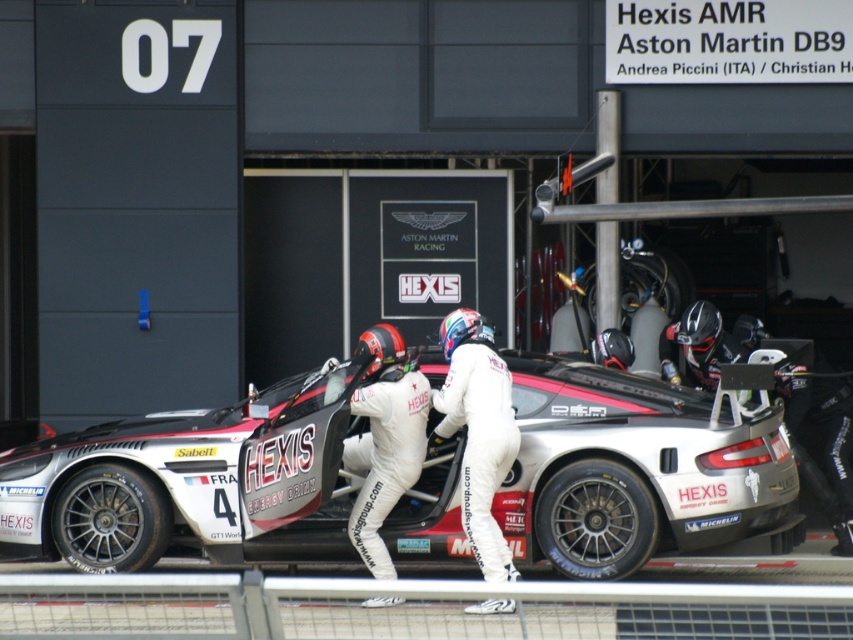
You are a photographer at the pit stop. You need to capture a clear photo of the white matte sports car at center without the white smooth suit at center blocking it. What should you do?

The white matte sports car at center is positioned under the white smooth suit at center. To avoid the obstruction, you can lower your camera angle to shoot from below the white smooth suit at center, ensuring the white matte sports car at center is fully visible.

You are a photographer standing at a motorsport pit stop. You want to capture a clear shot of the white matte sports car at center. The camera you are using has a maximum focus range of 12 meters. Will you be able to focus on the car from your current position?

The white matte sports car at center and the camera are 11.84 meters apart, which is within the camera maximum focus range of 12 meters. Therefore, you can focus on the car from your current position.

You are a photographer standing at the edge of the pit stop area. You want to capture a photo of both the white matte sports car at center and the white smooth suit at center in the same frame. Given that your camera has a minimum focus distance of 70 centimeters, will you be able to take the photo without moving closer?

The white matte sports car at center and the white smooth suit at center are 75.35 centimeters apart from each other. Since the camera requires a minimum focus distance of 70 centimeters, the distance between them is sufficient, so you can take the photo without moving closer.